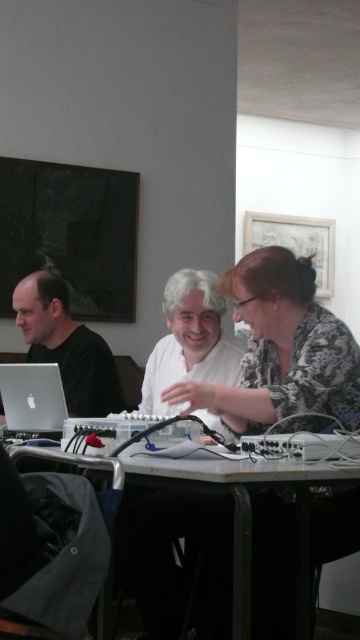
Question: Which of the following is the farthest from the observer?

Choices:
 (A) white plastic table at center
 (B) patterned fabric shirt at center

Answer: (B)

Question: Which of the following is the closest to the observer?

Choices:
 (A) matte black laptop at left
 (B) silver metallic laptop at lower left
 (C) white plastic table at center

Answer: (C)

Question: From the image, what is the correct spatial relationship of white plastic table at center in relation to silver metallic laptop at lower left?

Choices:
 (A) left
 (B) right

Answer: (B)

Question: Considering the real-world distances, which object is farthest from the white plastic table at center?

Choices:
 (A) matte black laptop at left
 (B) patterned fabric shirt at center

Answer: (A)

Question: Considering the relative positions of white plastic table at center and matte black laptop at left in the image provided, where is white plastic table at center located with respect to matte black laptop at left?

Choices:
 (A) above
 (B) below

Answer: (B)

Question: Does patterned fabric shirt at center come in front of white plastic table at center?

Choices:
 (A) no
 (B) yes

Answer: (A)